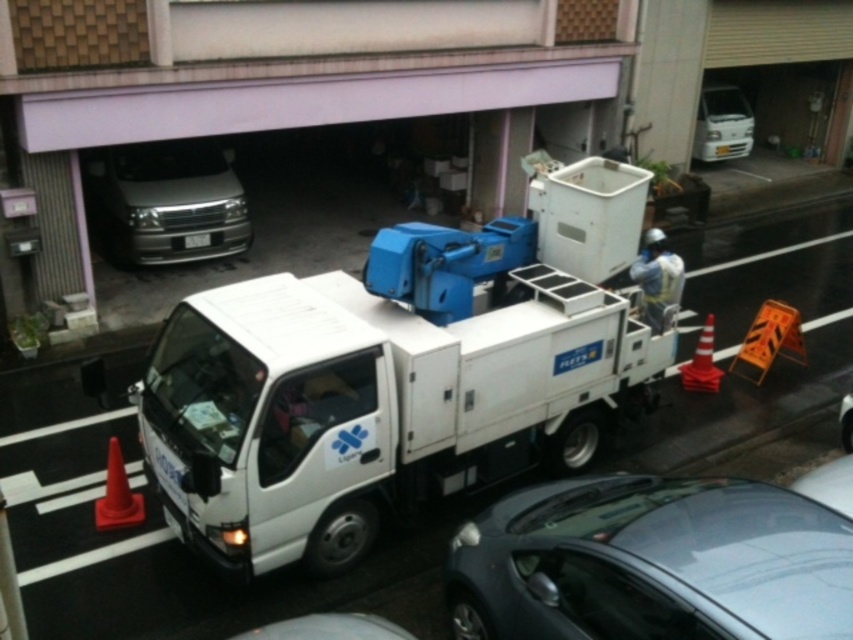
Is white matte truck at center positioned at the back of white matte van at upper center?

No, it is in front of white matte van at upper center.

Does white matte truck at center lie in front of white matte van at upper center?

Yes, white matte truck at center is in front of white matte van at upper center.

Who is more distant from viewer, (563, 413) or (718, 124)?

The point (718, 124) is more distant.

Image resolution: width=853 pixels, height=640 pixels. I want to click on white matte truck at center, so click(372, 406).

Can you confirm if satin silver van at center is shorter than reflective silver helmet at center?

In fact, satin silver van at center may be taller than reflective silver helmet at center.

Can you confirm if satin silver van at center is positioned above reflective silver helmet at center?

Yes.

Which is behind, point (142, 182) or point (637, 268)?

Point (142, 182)

The width and height of the screenshot is (853, 640). Identify the location of satin silver van at center. (165, 202).

Does reflective silver helmet at center have a lesser height compared to white plastic license plate at center?

In fact, reflective silver helmet at center may be taller than white plastic license plate at center.

Does reflective silver helmet at center have a larger size compared to white plastic license plate at center?

Indeed, reflective silver helmet at center has a larger size compared to white plastic license plate at center.

Who is more distant from viewer, (648,280) or (209,236)?

The point (209,236) is behind.

Identify the location of reflective silver helmet at center. This screenshot has width=853, height=640. (659, 278).